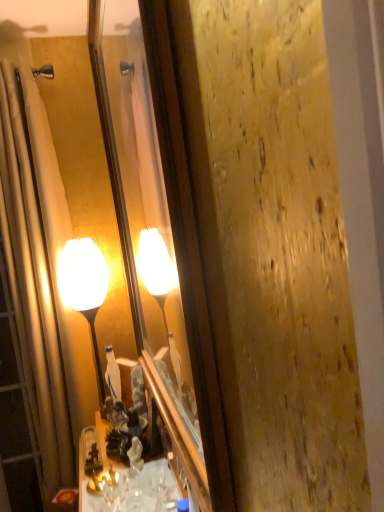
Question: Based on their sizes in the image, would you say matte glass mirror at center is bigger or smaller than matte glass lamp at center?

Choices:
 (A) small
 (B) big

Answer: (B)

Question: Is matte glass mirror at center spatially inside matte glass lamp at center, or outside of it?

Choices:
 (A) inside
 (B) outside

Answer: (B)

Question: Based on their relative distances, which object is nearer to the matte glass mirror at center?

Choices:
 (A) shiny brass cabinet at lower center
 (B) matte glass lamp at center
 (C) beige fabric shower curtain at left

Answer: (A)

Question: Which object is positioned closest to the shiny brass cabinet at lower center?

Choices:
 (A) matte glass lamp at center
 (B) matte glass mirror at center
 (C) beige fabric shower curtain at left

Answer: (B)